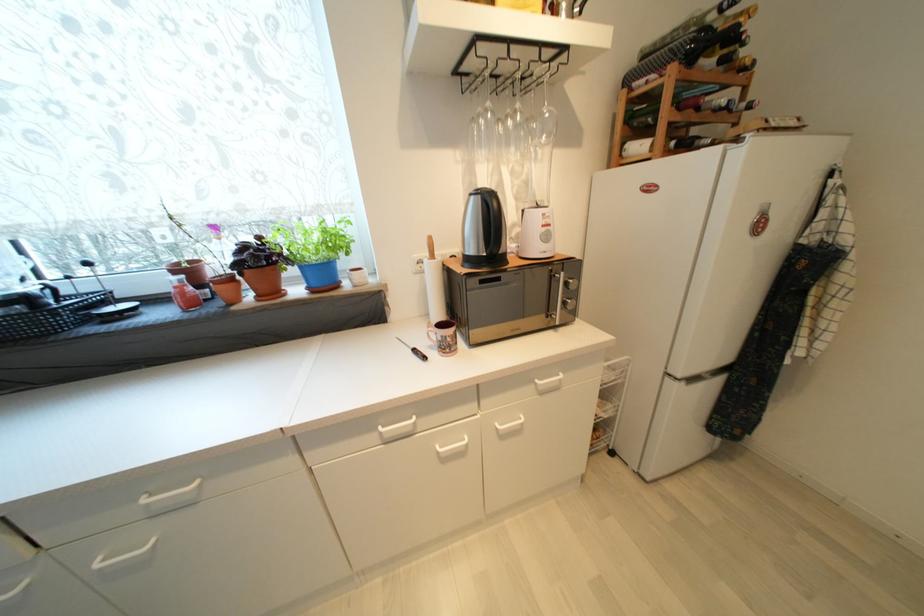
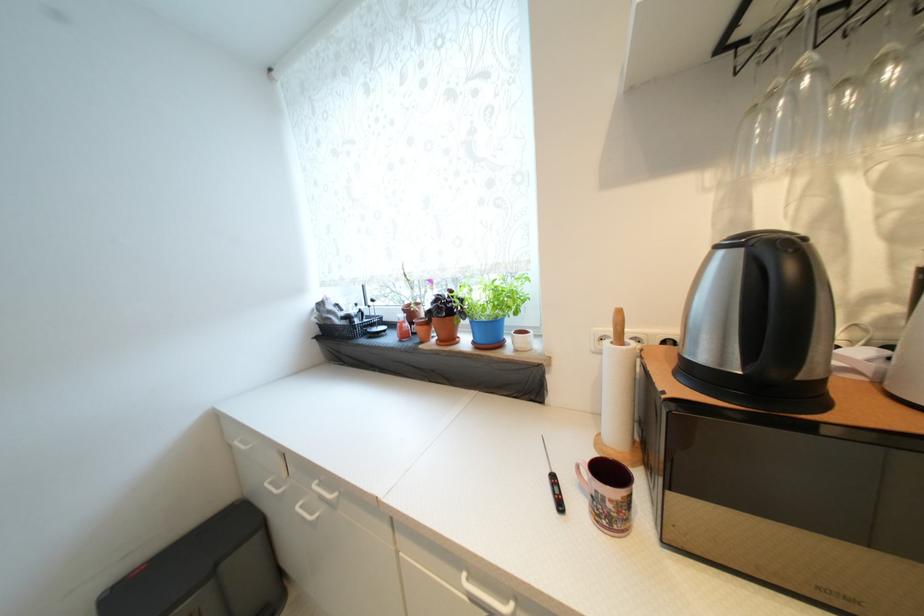
Question: Based on the continuous images, in which direction is the camera rotating? Reply with the corresponding letter.

Choices:
 (A) Left
 (B) Right
 (C) Up
 (D) Down

Answer: (A)